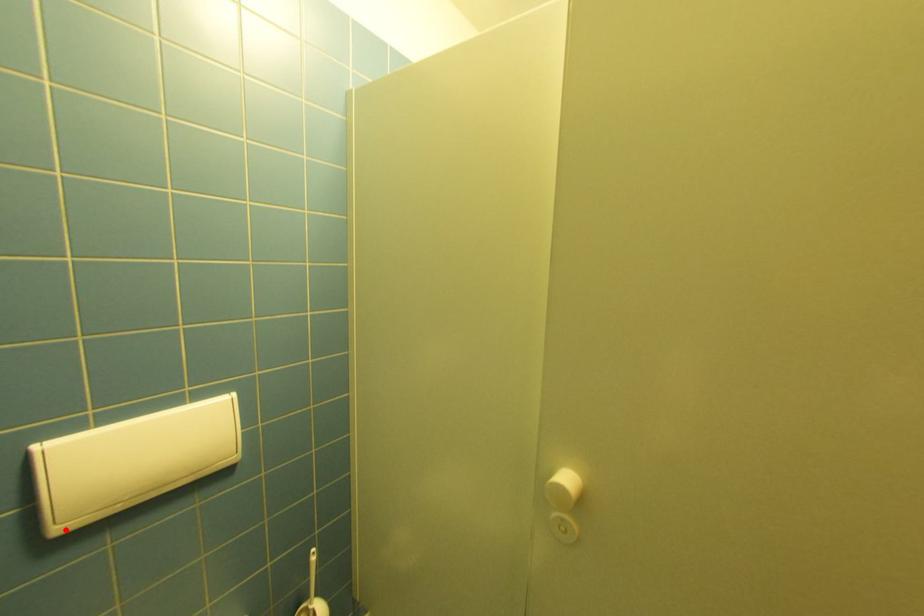
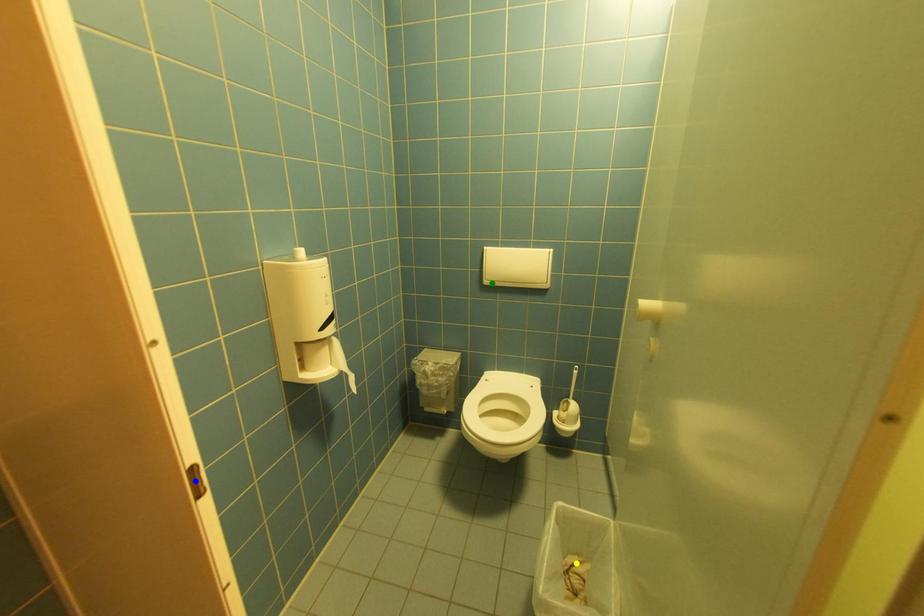
Question: I am providing you with two images of the same scene from different viewpoints. A red point is marked on the first image. You are given multiple points on the second image. Which mark in image 2 goes with the point in image 1?

Choices:
 (A) yellow point
 (B) blue point
 (C) green point

Answer: (C)